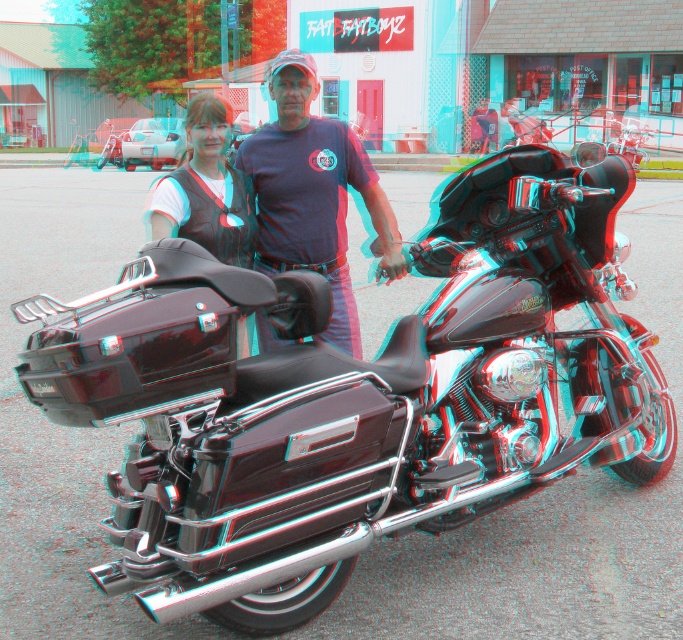
You are a photographer setting up a wide shot of the scene. The matte blue shirt at center and the matte black vest at center are both in the frame. Which clothing item would require more space in the horizontal direction for the shot to capture fully?

The matte blue shirt at center might be wider than the matte black vest at center, so it would require more space in the horizontal direction to capture fully.

You are a photographer taking a picture of the two people next to the motorcycle. You notice the matte blue shirt at center and the matte black vest at center. Which clothing item is positioned lower on the person?

The matte blue shirt at center is below the matte black vest at center, so the matte blue shirt at center is positioned lower.

You are a photographer standing at the camera position. You want to focus on the matte blue shirt at center. What are the coordinates you should aim for?

The coordinates you should aim for are point (x=313, y=195).